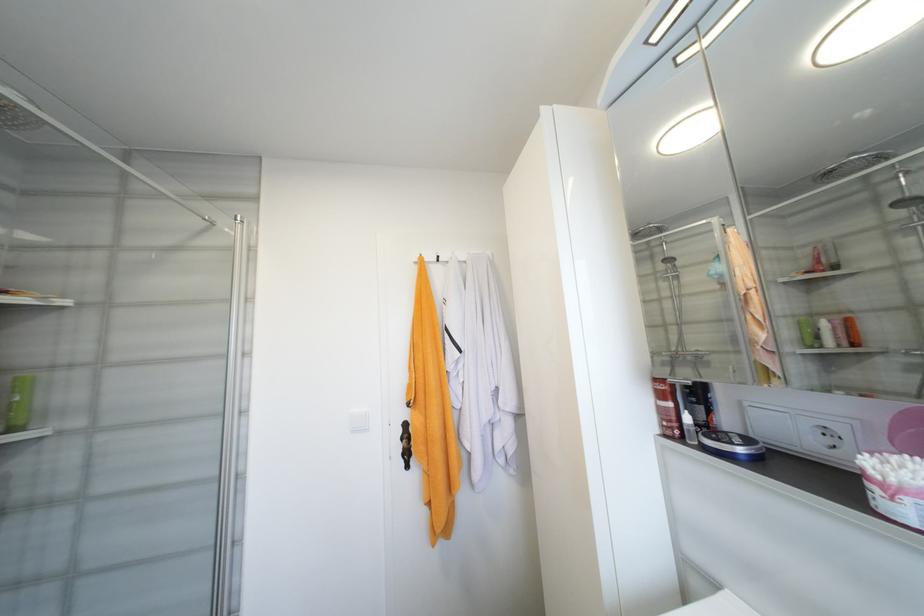
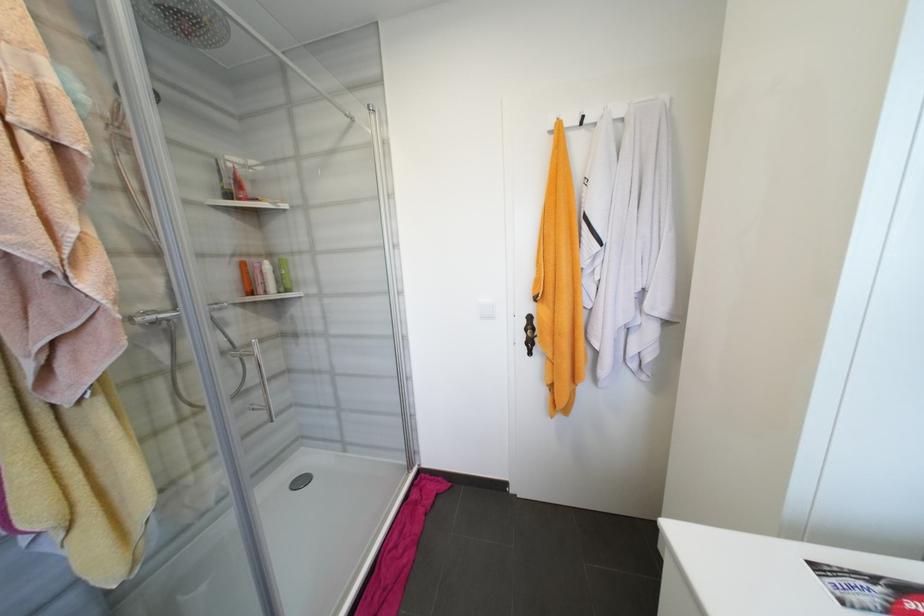
The images are taken continuously from a first-person perspective. In which direction is your viewpoint rotating?

The camera rotated toward left-down.